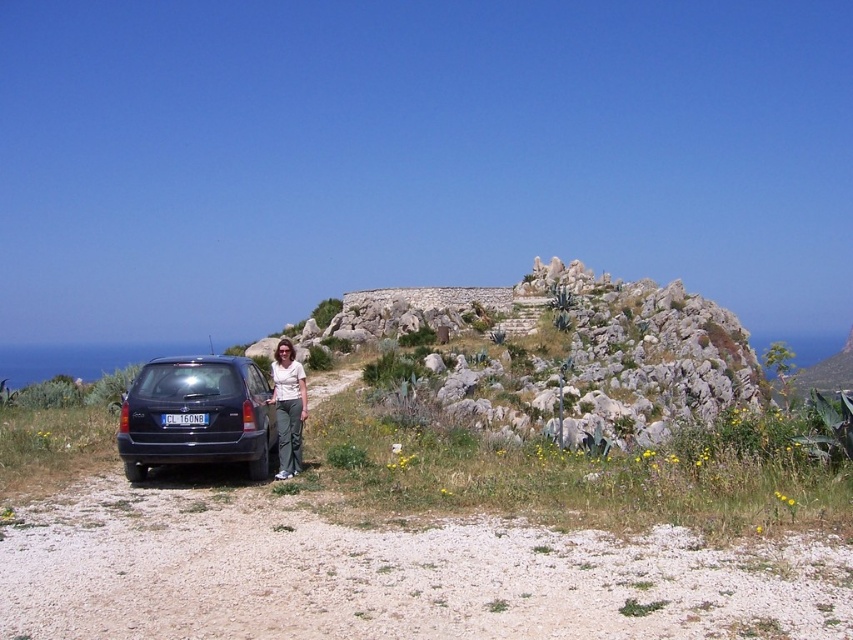
You are standing at the gravelly area next to the dark station wagon. Looking towards the rocky stone hillside at center, where is the matte white shirt at center in relation to the hillside?

The matte white shirt at center is below the rocky stone hillside at center because the hillside is above it.

You are a photographer trying to capture both the matte white shirt at center and the blue plastic license plate at center in the same frame. Given that your camera has a minimum focus distance of 20 feet, will you be able to focus on both objects simultaneously?

The matte white shirt at center and blue plastic license plate at center are 25.16 feet apart. Since the minimum focus distance is 20 feet, the distance between them is sufficient for both to be in focus. Yes, you can capture both in the same frame.

You are a photographer trying to capture the rocky stone hillside at center and the matte white shirt at center in the same frame. Which object will appear taller in the photo?

The rocky stone hillside at center will appear taller in the photo since it has a greater height compared to the matte white shirt at center.